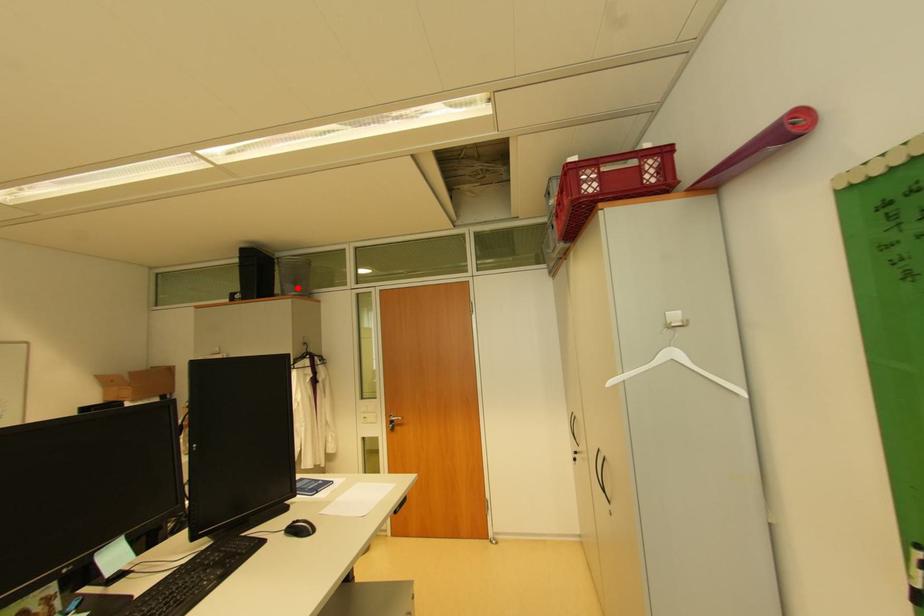
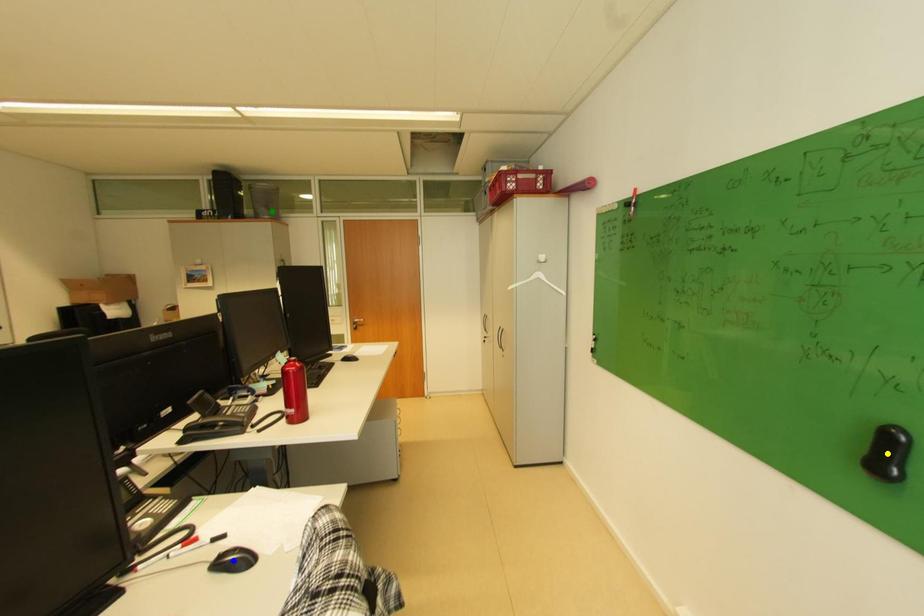
Question: I am providing you with two images of the same scene from different viewpoints. A red point is marked on the first image. You are given multiple points on the second image. In image 2, which mark is for the same physical point as the one in image 1?

Choices:
 (A) blue point
 (B) yellow point
 (C) green point

Answer: (C)